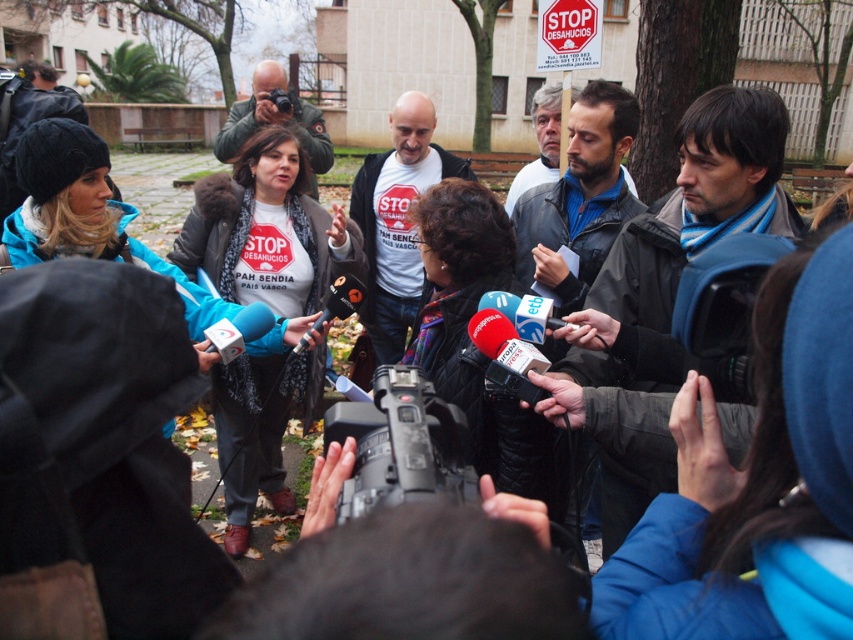
Between black plastic video camera at center and matte black camera at upper center, which one has more height?

With more height is matte black camera at upper center.

Can you confirm if black plastic video camera at center is positioned above matte black camera at upper center?

Incorrect, black plastic video camera at center is not positioned above matte black camera at upper center.

Is point (347, 419) closer to viewer compared to point (264, 77)?

Yes, it is.

You are a GUI agent. You are given a task and a screenshot of the screen. Output one action in this format:
    pyautogui.click(x=<x>, y=<y>)
    Task: Click on the black plastic video camera at center
    This screenshot has height=640, width=853.
    Given the screenshot: What is the action you would take?
    pyautogui.click(x=401, y=444)